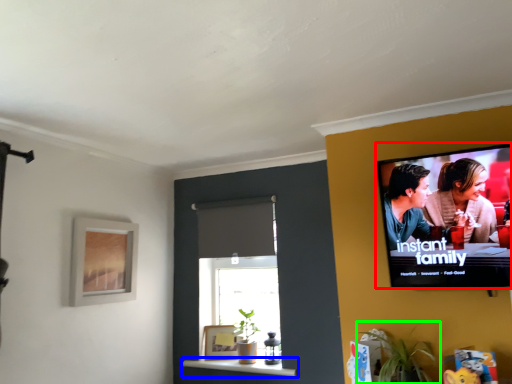
Question: Which object is positioned farthest from television (highlighted by a red box)? Select from window sill (highlighted by a blue box) and houseplant (highlighted by a green box).

Choices:
 (A) window sill
 (B) houseplant

Answer: (A)